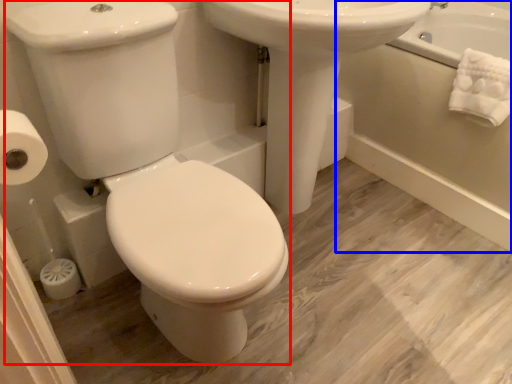
Question: Which point is further to the camera, porcelain (highlighted by a red box) or bath (highlighted by a blue box)?

Choices:
 (A) porcelain
 (B) bath

Answer: (B)